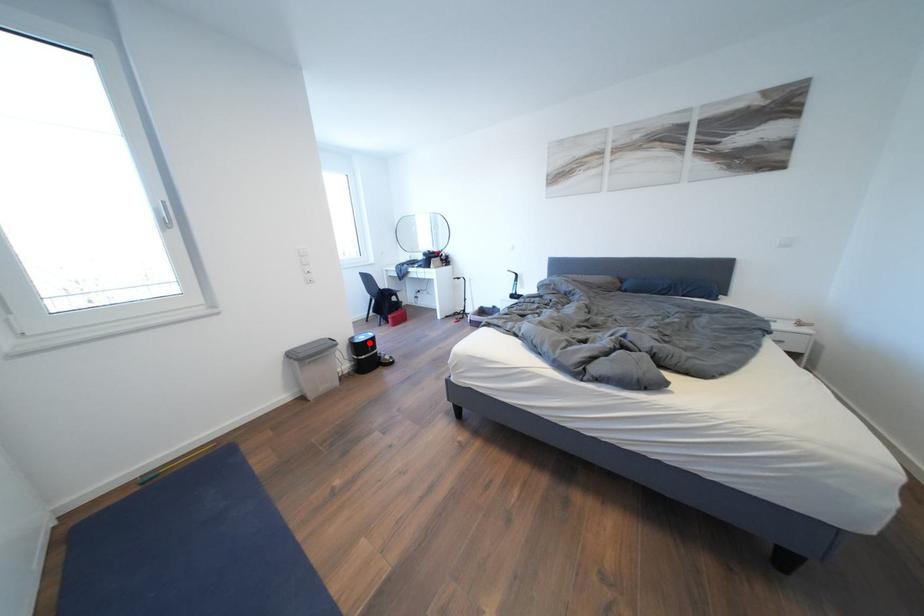
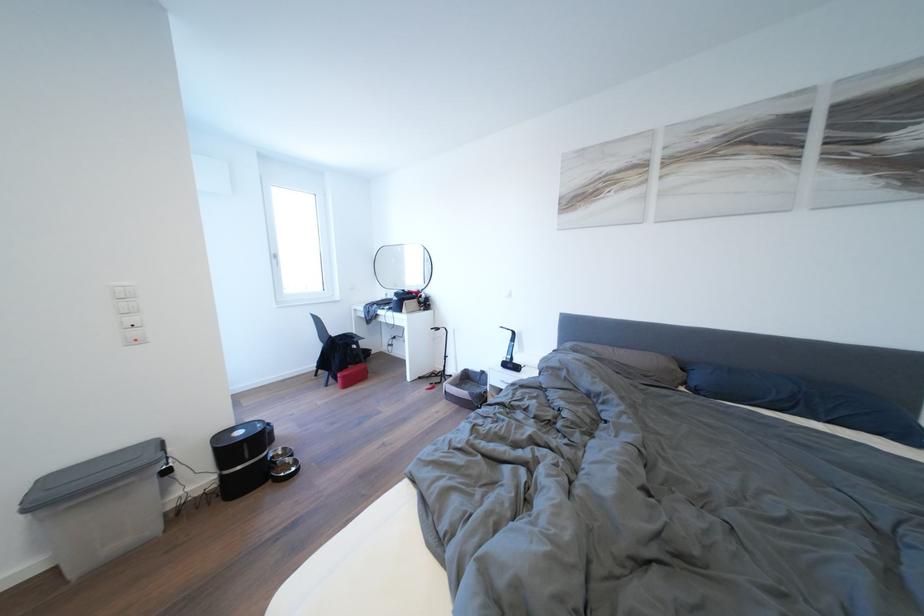
Question: I am providing you with two images of the same scene from different viewpoints. A red point is marked on the first image. Can you still see the location of the red point in image 2?

Choices:
 (A) Yes
 (B) No

Answer: (A)